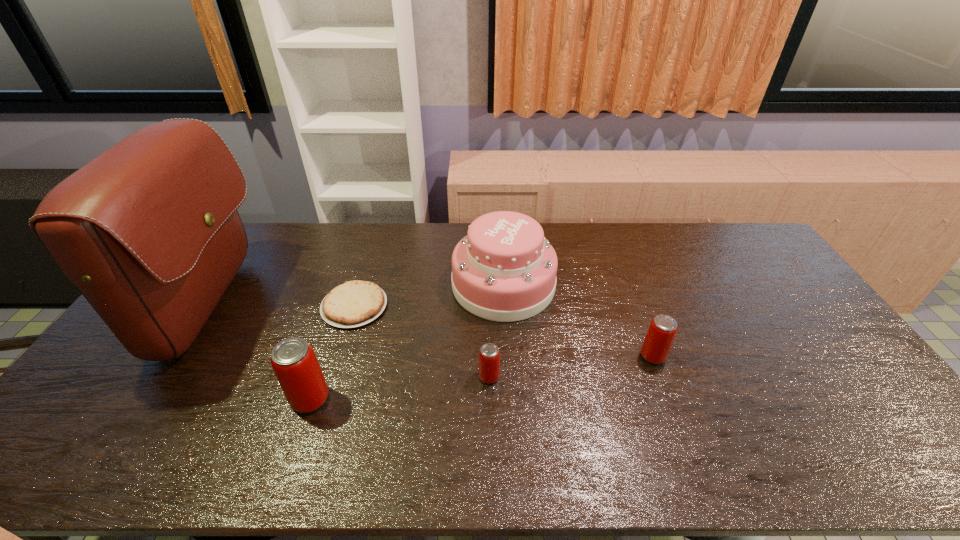
Please point a vacant point for placing a beer can on the right. Please provide its 2D coordinates. Your answer should be formatted as a tuple, i.e. [(x, y)], where the tuple contains the x and y coordinates of a point satisfying the conditions above.

[(804, 337)]